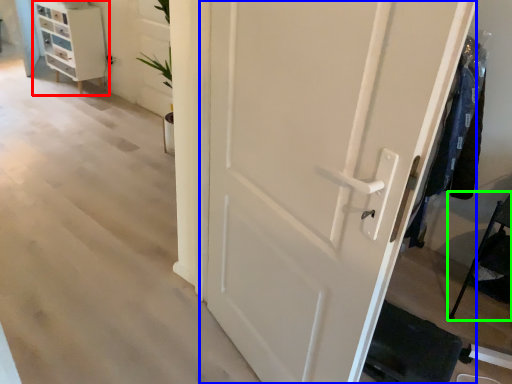
Question: Which object is the closest to the chest of drawers (highlighted by a red box)? Choose among these: door (highlighted by a blue box) or furniture (highlighted by a green box).

Choices:
 (A) door
 (B) furniture

Answer: (A)